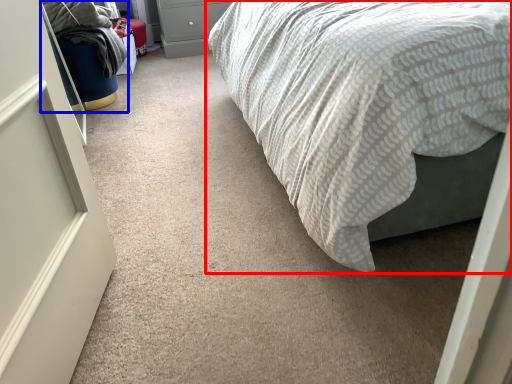
Question: Among these objects, which one is farthest to the camera, bed (highlighted by a red box) or bean bag chair (highlighted by a blue box)?

Choices:
 (A) bed
 (B) bean bag chair

Answer: (B)